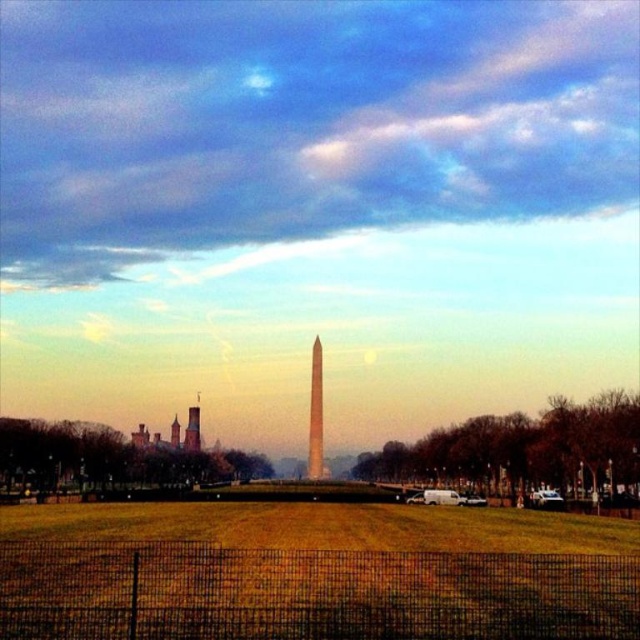
Which is more to the right, yellow grass at center or smooth glass obelisk at center?

smooth glass obelisk at center

Is yellow grass at center smaller than smooth glass obelisk at center?

No.

Is point (280, 564) closer to camera compared to point (308, 404)?

Yes, point (280, 564) is closer to viewer.

This screenshot has height=640, width=640. In order to click on yellow grass at center in this screenshot , I will do `click(314, 572)`.

Does cloudy sky at upper center have a larger size compared to yellow grass at center?

Correct, cloudy sky at upper center is larger in size than yellow grass at center.

Does cloudy sky at upper center lie in front of yellow grass at center?

No, it is behind yellow grass at center.

Identify the location of cloudy sky at upper center. (300, 124).

This screenshot has width=640, height=640. I want to click on cloudy sky at upper center, so click(x=300, y=124).

Can you confirm if cloudy sky at upper center is positioned to the left of smooth glass obelisk at center?

No, cloudy sky at upper center is not to the left of smooth glass obelisk at center.

The image size is (640, 640). Describe the element at coordinates (300, 124) in the screenshot. I see `cloudy sky at upper center` at that location.

Between point (365, 218) and point (307, 467), which one is positioned behind?

Point (365, 218)

Image resolution: width=640 pixels, height=640 pixels. In order to click on cloudy sky at upper center in this screenshot , I will do `click(300, 124)`.